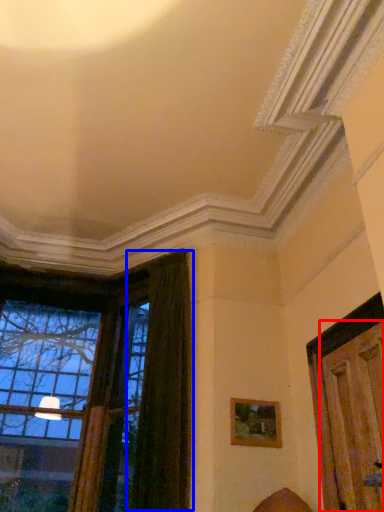
Question: Which point is further to the camera, door (highlighted by a red box) or curtain (highlighted by a blue box)?

Choices:
 (A) door
 (B) curtain

Answer: (B)